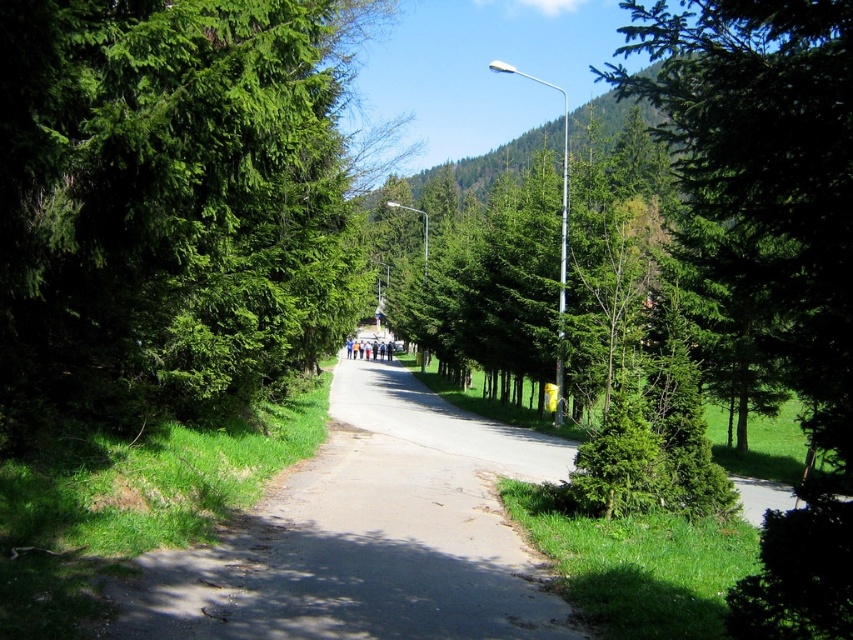
You are standing at the starting point of the tree lined road and want to walk towards the horizon. There are two points marked on the road, point A at coordinates point A is point (160, 278) and point B at coordinates point B is point (376, 340). Which point is closer to you as you face the direction of the road?

Point A at coordinates point A is point (160, 278) is closer to you because it is in front of point B at coordinates point B is point (376, 340) according to the description.

You are driving a truck that is 2 meters wide. You come across a road that is narrower than the width of a nearby tree. Based on the scene, can your truck safely pass through the smooth asphalt road at center without hitting the green glossy tree at right?

The smooth asphalt road at center has a lesser width compared to green glossy tree at right, meaning the road is narrower than the tree. Since the truck is 2 meters wide, it may not fit safely if the road is narrower than the truck. However, the question states the road is narrower than the tree, but we need to compare the truck width with the road width. Without exact measurements, it is unclear if the road is wider than the truck. The answer should clarify that the road is narrower than the tree but not a

You are a hiker planning to take a photo of the green leafy tree at center and the green glossy tree at right from the road. Which tree should you stand closer to in order to capture both trees in the same frame?

→ You should stand closer to the green leafy tree at center because it is shorter than the green glossy tree at right, allowing both trees to be captured in the same frame when positioned appropriately.